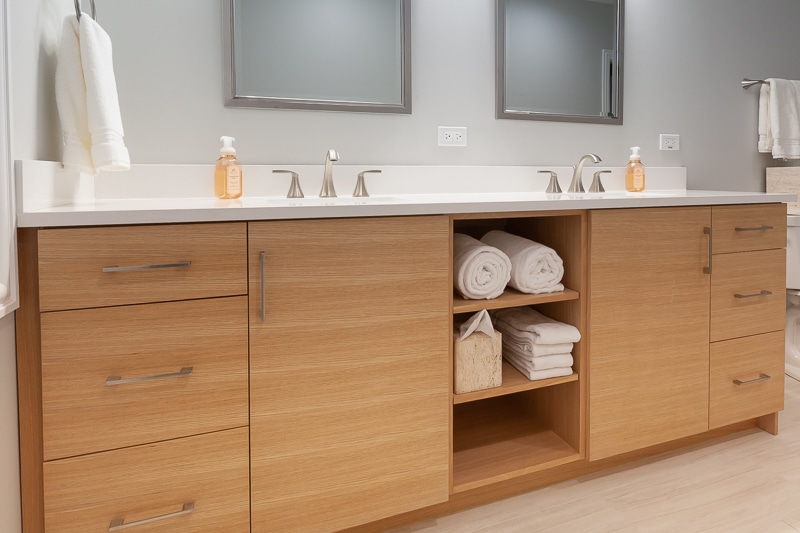
Locate an element on the screen. toilet is located at coordinates (794, 257).